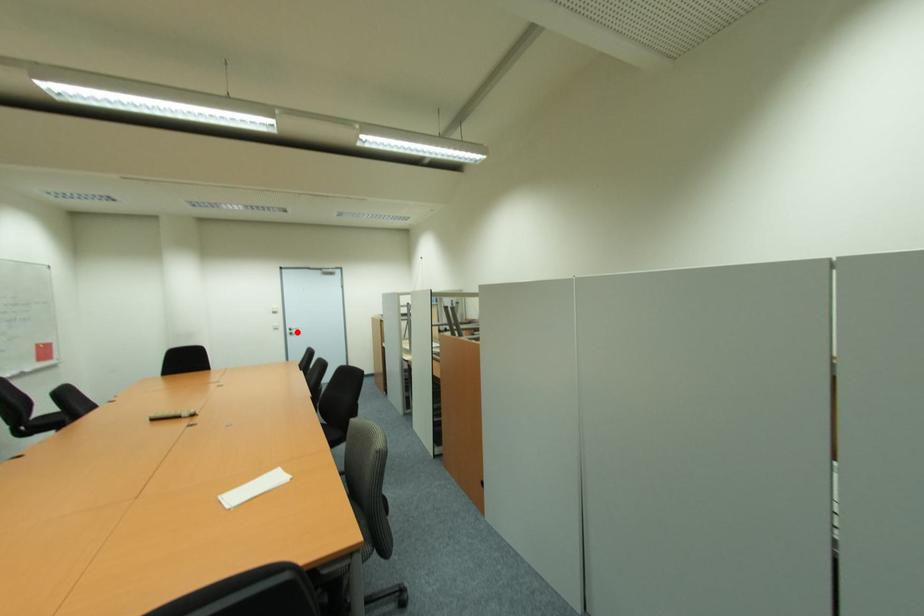
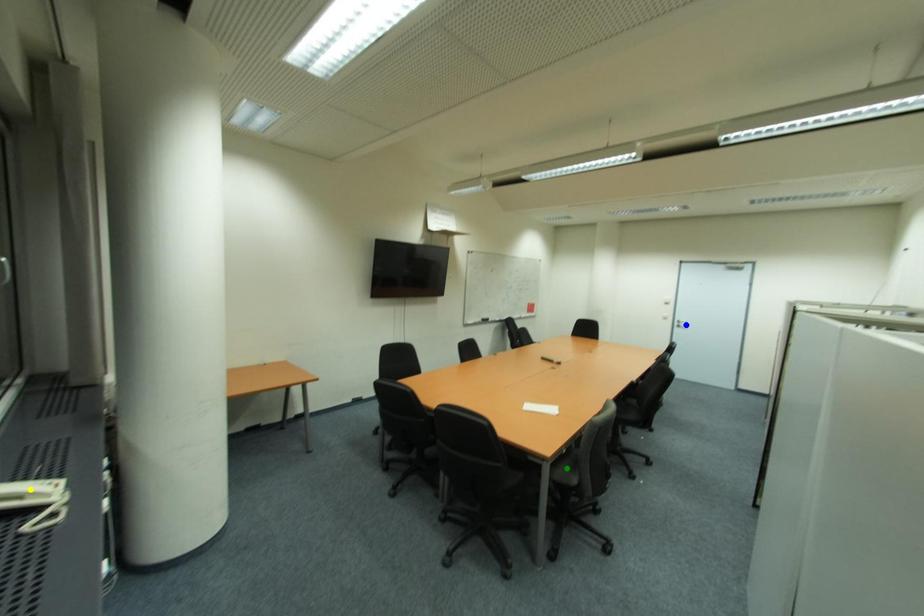
Question: I am providing you with two images of the same scene from different viewpoints. A red point is marked on the first image. You are given multiple points on the second image. In image 2, which mark is for the same physical point as the one in image 1?

Choices:
 (A) green point
 (B) yellow point
 (C) blue point

Answer: (C)